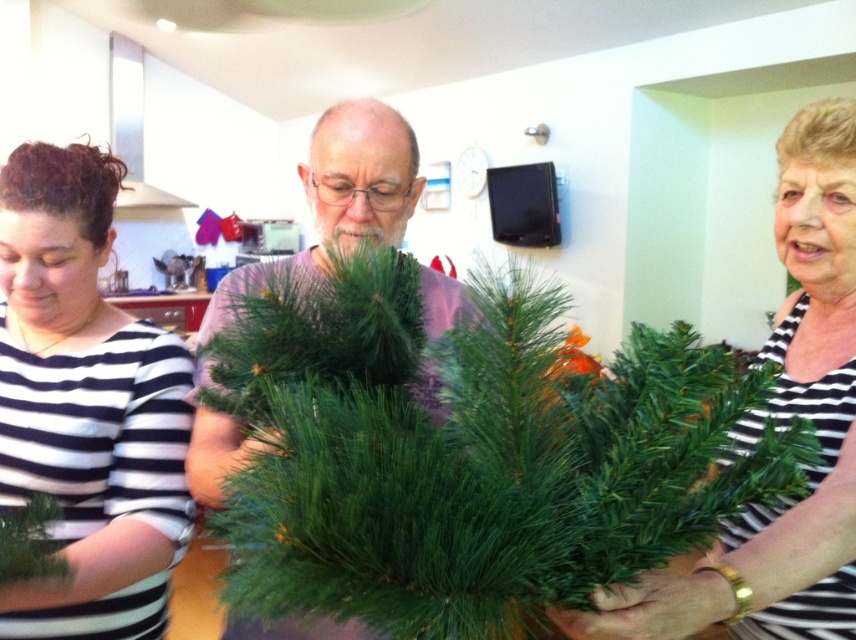
Question: Which is farther from the black striped shirt at left?

Choices:
 (A) green artificial at center
 (B) green matte pine branch at right

Answer: (B)

Question: Does green artificial at center appear on the right side of green matte pine branch at right?

Choices:
 (A) yes
 (B) no

Answer: (B)

Question: Is green artificial at center positioned at the back of green artificial tree at center?

Choices:
 (A) yes
 (B) no

Answer: (B)

Question: Which object is closer to the camera taking this photo?

Choices:
 (A) green matte pine branch at right
 (B) black striped shirt at left
 (C) green artificial tree at center
 (D) green artificial at center

Answer: (D)

Question: Can you confirm if black striped shirt at left is smaller than green matte pine branch at right?

Choices:
 (A) yes
 (B) no

Answer: (A)

Question: Based on their relative distances, which object is farther from the green matte pine branch at right?

Choices:
 (A) green artificial tree at center
 (B) green artificial at center
 (C) black striped shirt at left

Answer: (C)